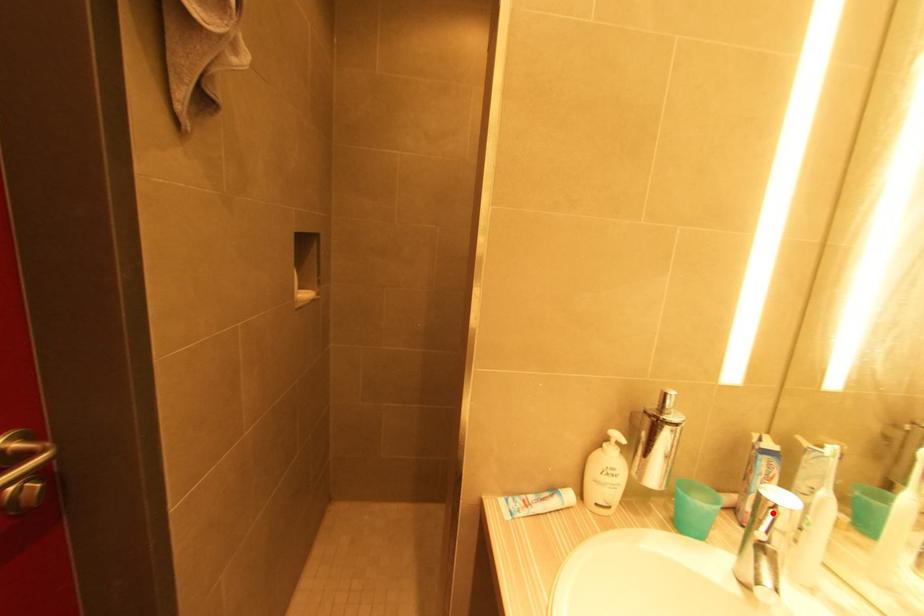
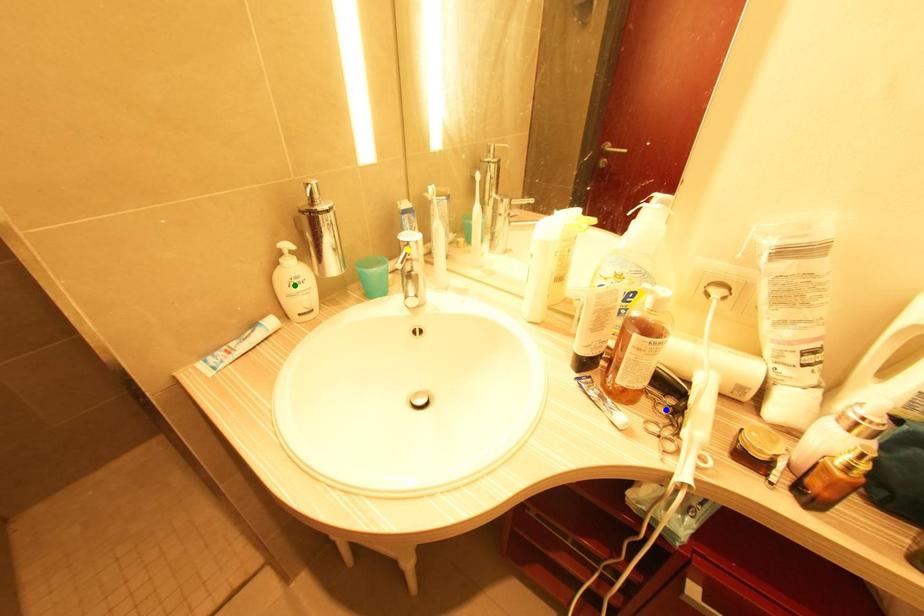
Question: I am providing you with two images of the same scene from different viewpoints. A red point is marked on the first image. You are given multiple points on the second image. Can you choose the point in image 2 that corresponds to the point in image 1?

Choices:
 (A) yellow point
 (B) green point
 (C) blue point

Answer: (A)